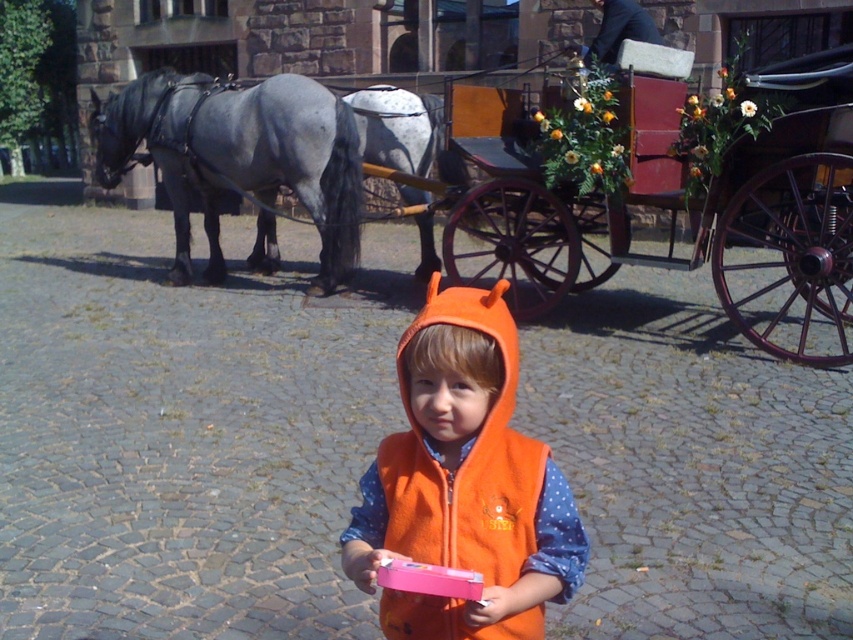
You are a photographer standing on the cobblestone street and want to take a photo of the gray matte horse at center and the wooden coach at upper center. Which object will appear closer to you in the photo?

The gray matte horse at center will appear closer to you in the photo because it is positioned further to the viewer than the wooden coach at upper center.

You are a photographer trying to capture a photo of the orange fleece vest at center and the gray glossy horse at left. Which object should you focus on first if you want to ensure both are in the frame without moving the camera? Explain your reasoning based on their sizes in the image.

The orange fleece vest at center is not as tall as the gray glossy horse at left. Therefore, you should focus on the gray glossy horse at left first since it is taller and occupies more vertical space, ensuring it fits within the frame before adjusting for the smaller orange fleece vest at center.

You are a photographer trying to capture the gray matte horse at center and the wooden coach at upper center in the same frame. Based on their positions, which object should you focus on first to ensure both are in the shot?

The gray matte horse at center is below the wooden coach at upper center, so you should focus on the wooden coach at upper center first to ensure both are in the shot.